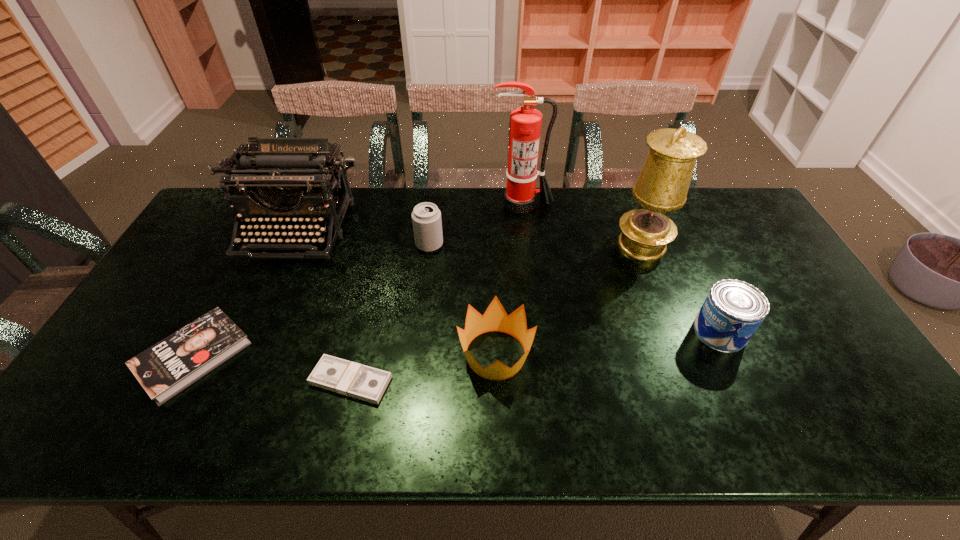
The image size is (960, 540). Identify the location of free space located on the front of the oil lamp. (657, 282).

You are a GUI agent. You are given a task and a screenshot of the screen. Output one action in this format:
    pyautogui.click(x=<x>, y=<y>)
    Task: Click on the vacant space located 0.100m on the typing side of the third tallest object
    The image size is (960, 540).
    Given the screenshot: What is the action you would take?
    pyautogui.click(x=270, y=290)

You are a GUI agent. You are given a task and a screenshot of the screen. Output one action in this format:
    pyautogui.click(x=<x>, y=<y>)
    Task: Click on the free space located 0.130m on the left of the farther can
    Image resolution: width=960 pixels, height=540 pixels.
    Given the screenshot: What is the action you would take?
    pyautogui.click(x=375, y=245)

This screenshot has width=960, height=540. I want to click on vacant area situated on the front label of the nearer can, so click(668, 332).

Where is `vacant space located 0.230m on the front label of the nearer can`? The image size is (960, 540). vacant space located 0.230m on the front label of the nearer can is located at coordinates (609, 332).

Identify the location of vacant position located on the front label of the nearer can. (664, 332).

Find the location of a particular element. Image resolution: width=960 pixels, height=540 pixels. free spot located on the back of the crown is located at coordinates (493, 280).

This screenshot has width=960, height=540. What are the coordinates of `vacant space located 0.360m on the right of the book` in the screenshot? It's located at (387, 356).

Where is `free space located 0.060m on the right of the dollar`? free space located 0.060m on the right of the dollar is located at coordinates click(x=417, y=381).

Locate an element on the screen. Image resolution: width=960 pixels, height=540 pixels. fire extinguisher that is at the far edge is located at coordinates (520, 195).